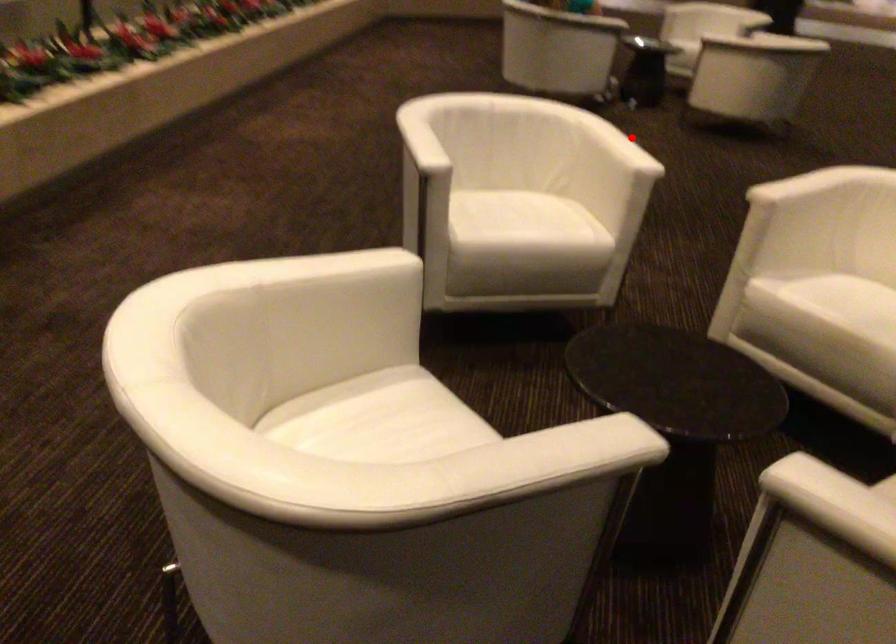
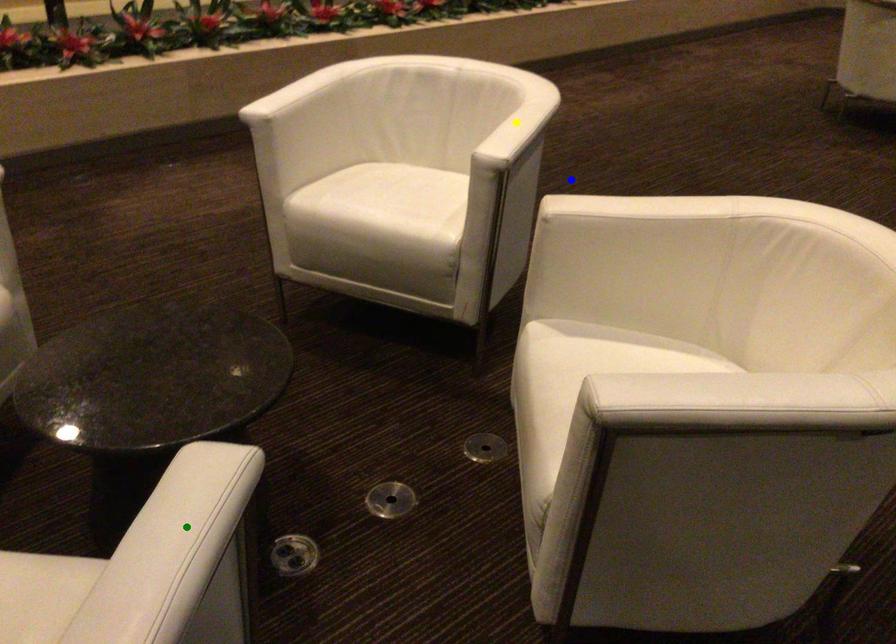
Question: I am providing you with two images of the same scene from different viewpoints. A red point is marked on the first image. You are given multiple points on the second image. Which point in image 2 is actually the same real-world point as the red point in image 1?

Choices:
 (A) yellow point
 (B) green point
 (C) blue point

Answer: (A)